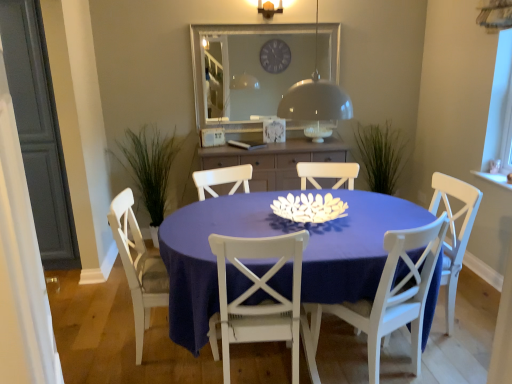
Question: From the image's perspective, is matte blue table at center under clear glass mirror at upper center?

Choices:
 (A) no
 (B) yes

Answer: (B)

Question: Does matte blue table at center have a lesser width compared to clear glass mirror at upper center?

Choices:
 (A) no
 (B) yes

Answer: (A)

Question: Is matte blue table at center positioned beyond the bounds of clear glass mirror at upper center?

Choices:
 (A) no
 (B) yes

Answer: (B)

Question: Is matte blue table at center bigger than clear glass mirror at upper center?

Choices:
 (A) yes
 (B) no

Answer: (A)

Question: Does matte blue table at center have a greater width compared to clear glass mirror at upper center?

Choices:
 (A) no
 (B) yes

Answer: (B)

Question: Is green grass at left spatially inside clear glass mirror at upper center, or outside of it?

Choices:
 (A) inside
 (B) outside

Answer: (B)

Question: Is green grass at left to the left or to the right of clear glass mirror at upper center in the image?

Choices:
 (A) left
 (B) right

Answer: (A)

Question: In terms of width, does green grass at left look wider or thinner when compared to clear glass mirror at upper center?

Choices:
 (A) wide
 (B) thin

Answer: (A)

Question: Is point (176, 147) positioned closer to the camera than point (209, 62)?

Choices:
 (A) farther
 (B) closer

Answer: (A)

Question: From a real-world perspective, is matte wood cabinet at center above or below white painted wood chair at center, placed as the second chair when sorted from left to right?

Choices:
 (A) below
 (B) above

Answer: (B)

Question: Considering the positions of matte wood cabinet at center and white painted wood chair at center, placed as the second chair when sorted from left to right, in the image, is matte wood cabinet at center taller or shorter than white painted wood chair at center, placed as the second chair when sorted from left to right,?

Choices:
 (A) short
 (B) tall

Answer: (A)

Question: In terms of width, does matte wood cabinet at center look wider or thinner when compared to white painted wood chair at center, placed as the second chair when sorted from left to right?

Choices:
 (A) thin
 (B) wide

Answer: (B)

Question: Considering the positions of matte wood cabinet at center and white painted wood chair at center, the 3th chair in the right-to-left sequence, in the image, is matte wood cabinet at center bigger or smaller than white painted wood chair at center, the 3th chair in the right-to-left sequence,?

Choices:
 (A) big
 (B) small

Answer: (A)

Question: From a real-world perspective, is white painted wood chair at center, placed as the second chair when sorted from left to right, positioned above or below matte blue table at center?

Choices:
 (A) below
 (B) above

Answer: (B)

Question: Do you think white painted wood chair at center, the 3th chair in the right-to-left sequence, is within matte blue table at center, or outside of it?

Choices:
 (A) inside
 (B) outside

Answer: (A)